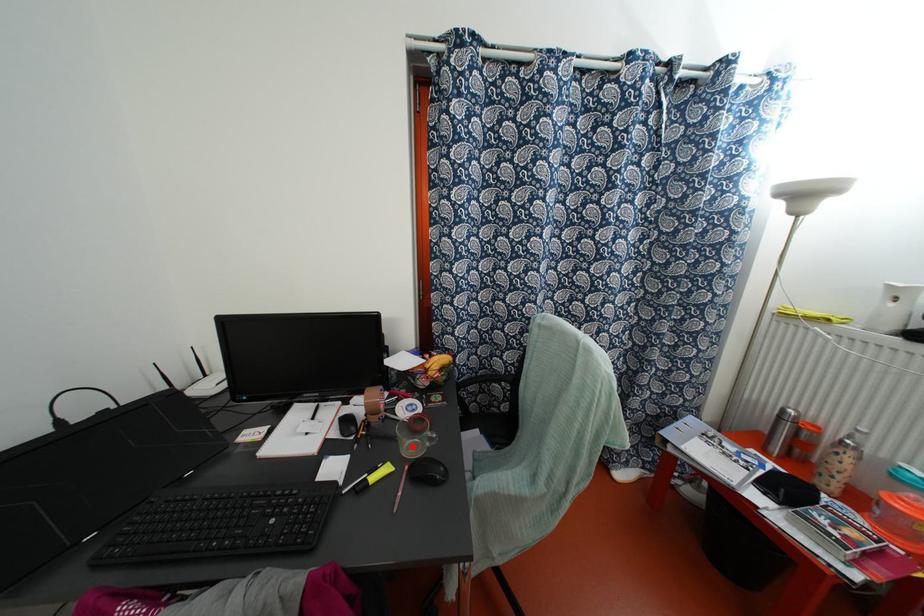
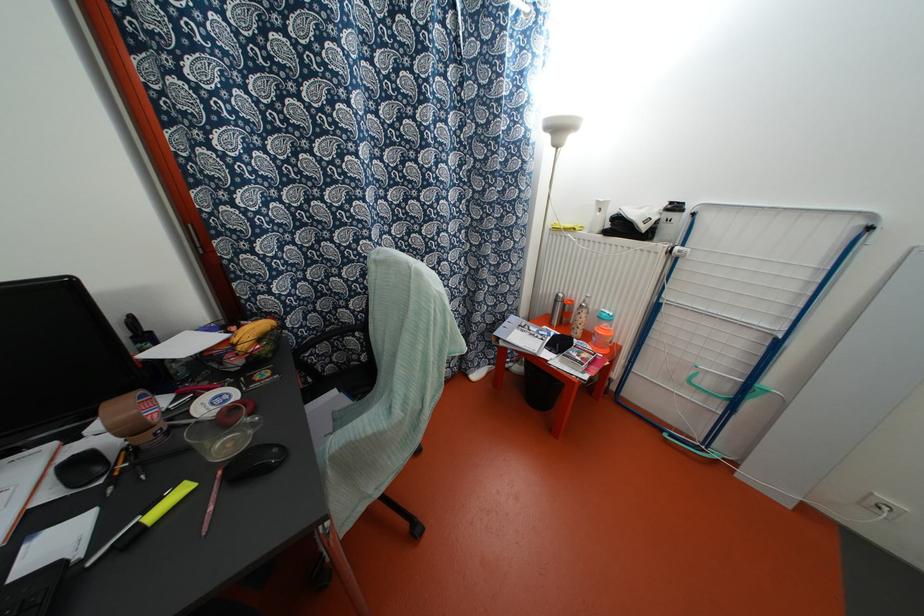
Where in the second image is the point corresponding to the highlighted location from the first image?

(228, 444)